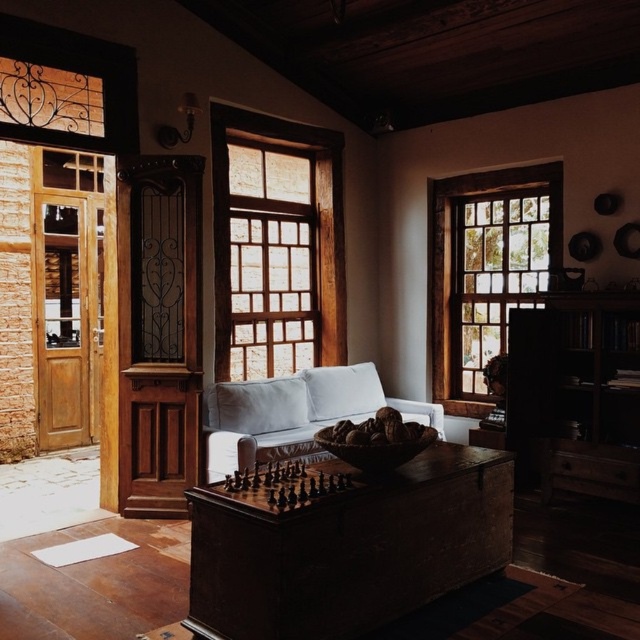
You are a delivery person standing at the entrance of the room. You need to place a package that is 2 meters long on the floor. Is there enough space between the wooden chest at center and the entrance for the package?

The wooden chest at center is 2.34 meters from the camera. Since the package is 2 meters long, there is sufficient space between the wooden chest at center and the entrance to place the package.

You are moving a large rectangular box that is 30 cm thick. You need to place it between the wooden frame at right and the light gray fabric couch at center. Can you fit it there?

The wooden frame at right is thinner than the light gray fabric couch at center, so the 30 cm thick box may not fit between them if the space between the two objects is narrower than 30 cm. However, without exact measurements of the space, it is uncertain.